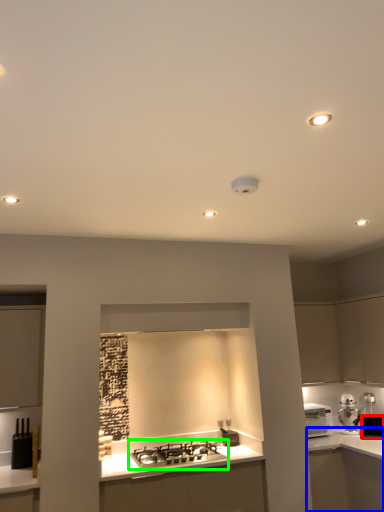
Question: Considering the real-world distances, which object is farthest from appliance (highlighted by a red box)? counter (highlighted by a blue box) or gas stove (highlighted by a green box)?

Choices:
 (A) counter
 (B) gas stove

Answer: (B)